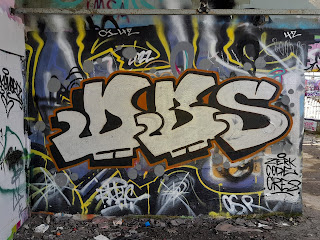
I want to click on 1 wall on the left, so click(x=12, y=203).